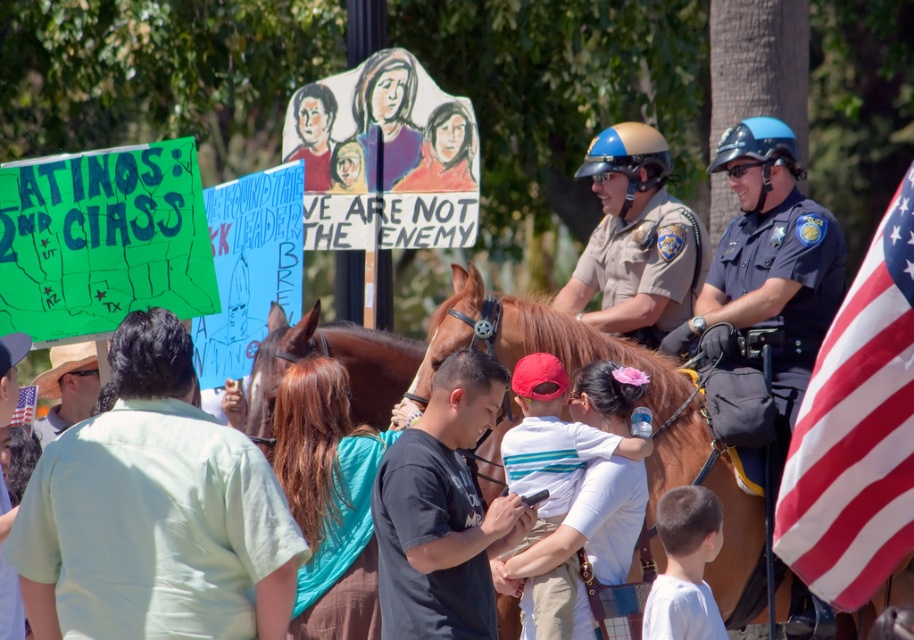
Can you confirm if red/white striped flag at right is taller than white matte shirt at lower right?

Indeed, red/white striped flag at right has a greater height compared to white matte shirt at lower right.

Between red/white striped flag at right and white matte shirt at lower right, which one has more height?

red/white striped flag at right is taller.

Where is `red/white striped flag at right`? red/white striped flag at right is located at coordinates (856, 429).

What do you see at coordinates (154, 513) in the screenshot? The image size is (914, 640). I see `light green fabric shirt at center-left` at bounding box center [154, 513].

Measure the distance between light green fabric shirt at center-left and camera.

light green fabric shirt at center-left is 99.24 feet from camera.

This screenshot has height=640, width=914. Describe the element at coordinates (154, 513) in the screenshot. I see `light green fabric shirt at center-left` at that location.

Identify the location of light green fabric shirt at center-left. This screenshot has width=914, height=640. (154, 513).

Is blue uniformed officer at right to the left of dark gray t-shirt at center from the viewer's perspective?

Incorrect, blue uniformed officer at right is not on the left side of dark gray t-shirt at center.

Which is more to the right, blue uniformed officer at right or dark gray t-shirt at center?

From the viewer's perspective, blue uniformed officer at right appears more on the right side.

Which is in front, point (785, 124) or point (479, 621)?

Positioned in front is point (479, 621).

The width and height of the screenshot is (914, 640). I want to click on blue uniformed officer at right, so click(767, 275).